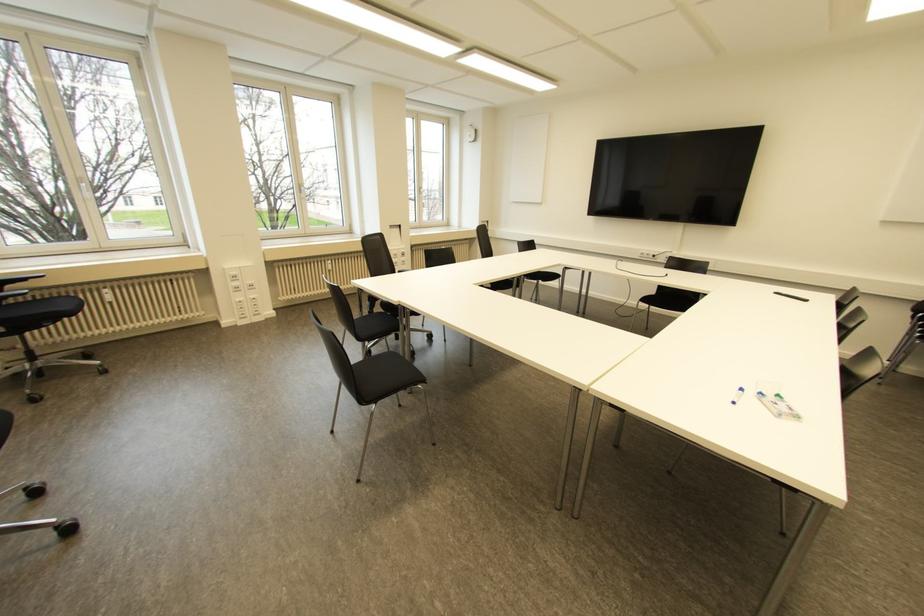
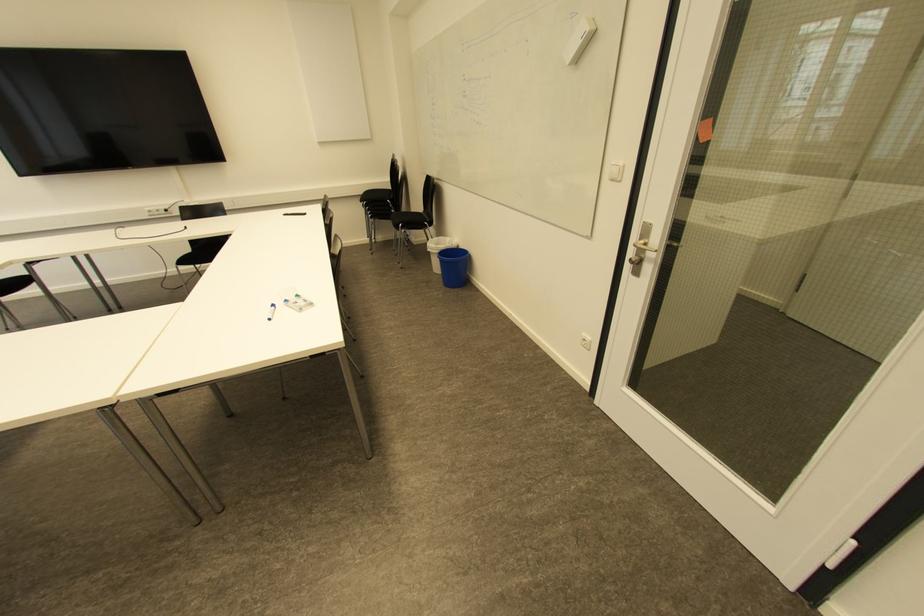
Locate, in the second image, the point that corresponds to [739,390] in the first image.

(273, 306)